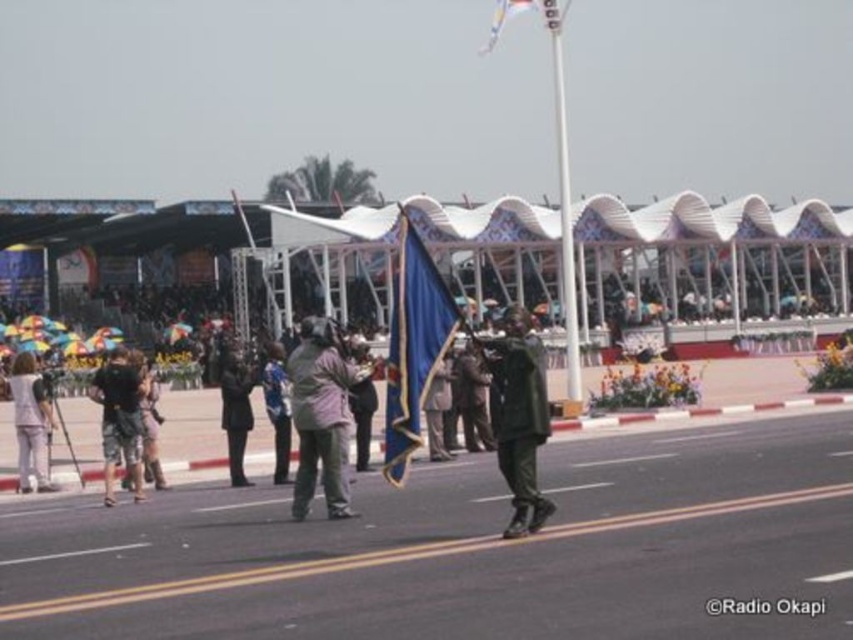
Question: Does green matte uniform at center appear on the left side of black fabric coat at center?

Choices:
 (A) no
 (B) yes

Answer: (A)

Question: Based on their relative distances, which object is farther from the dark blue fabric at center?

Choices:
 (A) dark green camouflage pants at center
 (B) blue fabric flag at upper center

Answer: (B)

Question: Can you confirm if blue satin flag at center is bigger than black fabric coat at center?

Choices:
 (A) no
 (B) yes

Answer: (B)

Question: Which point is farther to the camera?

Choices:
 (A) (515, 6)
 (B) (401, 340)
 (C) (138, 454)
 (D) (318, 422)

Answer: (A)

Question: Which of the following is the closest to the observer?

Choices:
 (A) (444, 352)
 (B) (515, 419)

Answer: (B)

Question: Does blue satin flag at center have a larger size compared to pink fabric jacket at center?

Choices:
 (A) no
 (B) yes

Answer: (B)